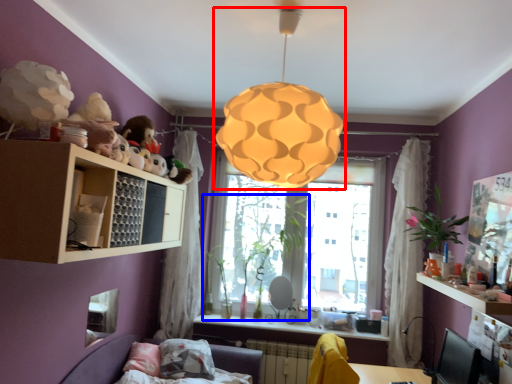
Question: Which of the following is the farthest to the observer, lamp (highlighted by a red box) or plant (highlighted by a blue box)?

Choices:
 (A) lamp
 (B) plant

Answer: (B)